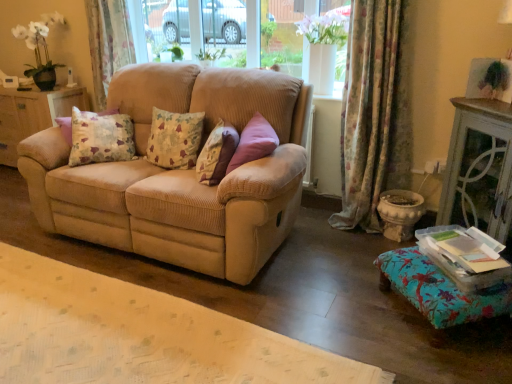
Question: From their relative heights in the image, would you say floral fabric cushion at center, placed as the 2th pillow when sorted from right to left, is taller or shorter than clear glass window at center?

Choices:
 (A) tall
 (B) short

Answer: (B)

Question: Based on their positions, is floral fabric cushion at center, placed as the 2th pillow when sorted from right to left, located to the left or right of clear glass window at center?

Choices:
 (A) left
 (B) right

Answer: (A)

Question: Which object is the closest to the floral fabric cushion at center, which ranks as the first pillow in left-to-right order?

Choices:
 (A) matte wood dresser at left
 (B) floral fabric ottoman at lower right
 (C) clear glass window at center
 (D) floral fabric curtain at upper left, arranged as the 2th curtain when viewed from the front
 (E) floral fabric curtain at right, which appears as the 1th curtain when viewed from the right

Answer: (E)

Question: Considering the real-world distances, which object is farthest from the matte wood dresser at left?

Choices:
 (A) beige corduroy couch at center
 (B) floral fabric cushion at center, which ranks as the first pillow in left-to-right order
 (C) fluffy beige pillow at center, the 1th pillow when ordered from right to left
 (D) floral fabric ottoman at lower right
 (E) floral fabric curtain at upper left, the second curtain when ordered from right to left

Answer: (D)